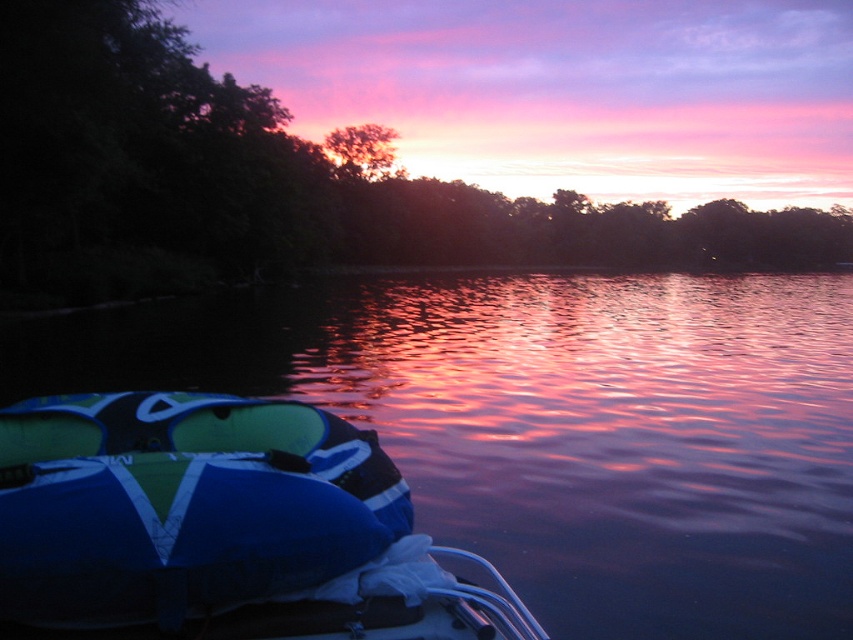
Does glossy water at center have a lesser width compared to green leafy tree at center?

Yes.

Can you confirm if glossy water at center is wider than green leafy tree at center?

Incorrect, glossy water at center's width does not surpass green leafy tree at center's.

Identify the location of glossy water at center. The image size is (853, 640). (553, 426).

The width and height of the screenshot is (853, 640). What are the coordinates of `glossy water at center` in the screenshot? It's located at (553, 426).

Is glossy water at center positioned in front of blue fabric boat at lower left?

No.

Based on the photo, does glossy water at center have a greater width compared to blue fabric boat at lower left?

Correct, the width of glossy water at center exceeds that of blue fabric boat at lower left.

Between point (672, 563) and point (108, 568), which one is positioned behind?

The point (672, 563) is more distant.

Where is `glossy water at center`? glossy water at center is located at coordinates (553, 426).

What do you see at coordinates (553, 426) in the screenshot? The width and height of the screenshot is (853, 640). I see `glossy water at center` at bounding box center [553, 426].

Looking at this image, which is more to the left, glossy water at center or silhouetted tree at center?

From the viewer's perspective, silhouetted tree at center appears more on the left side.

Does point (335, 406) come farther from viewer compared to point (337, 168)?

No, it is in front of (337, 168).

You are a GUI agent. You are given a task and a screenshot of the screen. Output one action in this format:
    pyautogui.click(x=<x>, y=<y>)
    Task: Click on the glossy water at center
    The width and height of the screenshot is (853, 640).
    Given the screenshot: What is the action you would take?
    pyautogui.click(x=553, y=426)